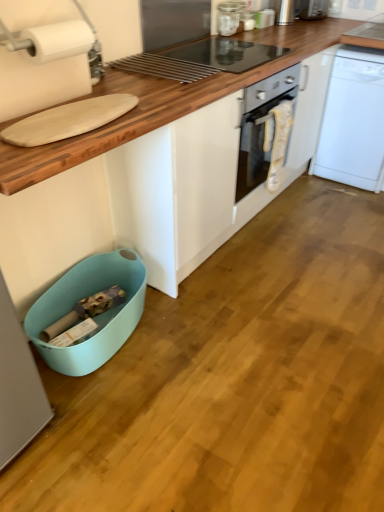
Find the location of a particular element. This screenshot has height=512, width=384. unoccupied region to the right of metallic silver toaster at upper center, the 3th appliance when ordered from top to bottom is located at coordinates (291, 29).